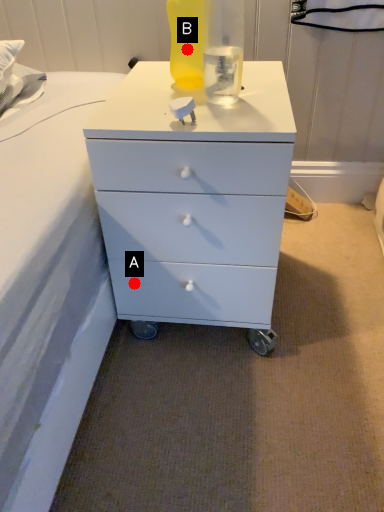
Question: Two points are circled on the image, labeled by A and B beside each circle. Among these points, which one is nearest to the camera?

Choices:
 (A) A is closer
 (B) B is closer

Answer: (B)